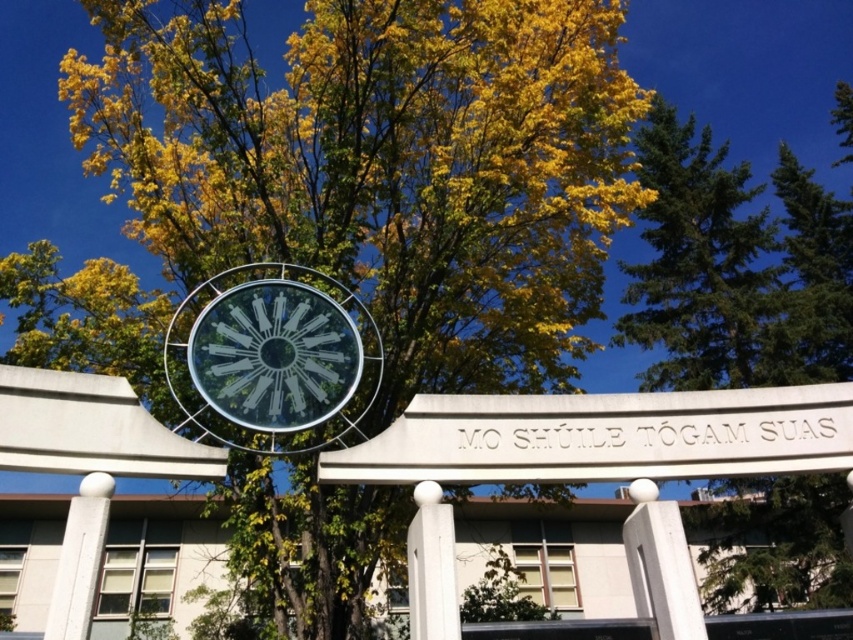
Question: Considering the real-world distances, which object is farthest from the green leafy tree at upper right?

Choices:
 (A) white glossy pillar at center
 (B) white concrete pillar at lower left

Answer: (B)

Question: Where is white glossy pillar at center located in relation to white concrete pillar at lower left in the image?

Choices:
 (A) below
 (B) above

Answer: (A)

Question: Which of these objects is positioned closest to the white glossy pillar at center?

Choices:
 (A) green leafy tree at upper right
 (B) white concrete pillar at lower left

Answer: (B)

Question: Does green leafy tree at upper right appear under transparent glass clock at center?

Choices:
 (A) no
 (B) yes

Answer: (A)

Question: Which point appears closest to the camera in this image?

Choices:
 (A) (757, 326)
 (B) (73, 561)
 (C) (224, 300)
 (D) (407, 579)

Answer: (B)

Question: Is transparent glass clock at center positioned behind white concrete pillar at lower left?

Choices:
 (A) no
 (B) yes

Answer: (B)